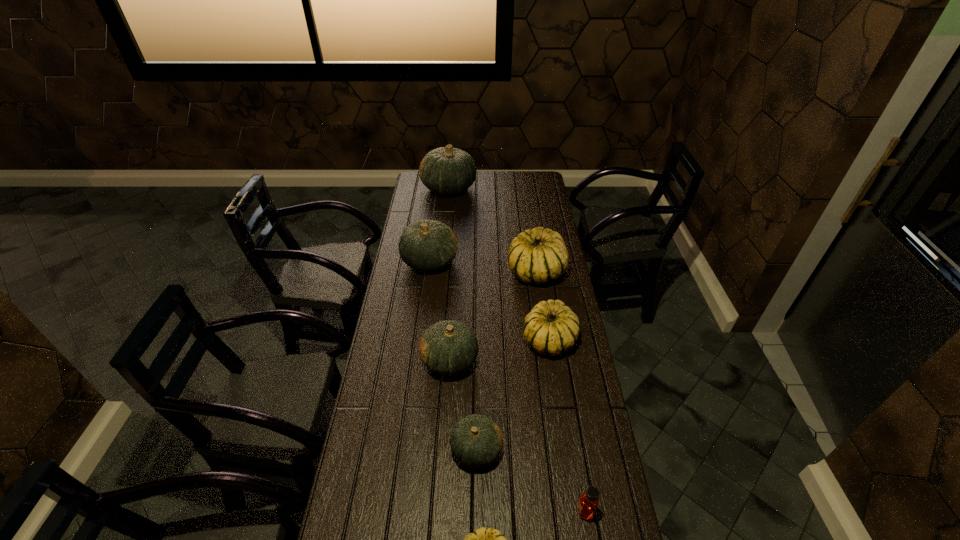
This screenshot has width=960, height=540. I want to click on the sixth closest object to the seventh farthest object, so click(426, 245).

Locate which object is the closest to the leftmost white gourd. Please provide its 2D coordinates. Your answer should be formatted as a tuple, i.e. [(x, y)], where the tuple contains the x and y coordinates of a point satisfying the conditions above.

[(476, 441)]

Identify the location of gourd that stands as the sixth closest to the farthest gourd. (482, 539).

Image resolution: width=960 pixels, height=540 pixels. I want to click on the third closest gourd to the seventh farthest object, so click(449, 347).

Locate an element on the screen. orange gourd that is the third closest to the nearest white gourd is located at coordinates pyautogui.click(x=426, y=245).

In order to click on the third closest orange gourd relative to the second smallest orange gourd in this screenshot , I will do `click(446, 170)`.

Identify the location of the third closest white gourd to the third biggest orange gourd. (482, 539).

This screenshot has width=960, height=540. I want to click on white gourd identified as the second closest to the third smallest orange gourd, so click(551, 328).

I want to click on vacant space that satisfies the following two spatial constraints: 1. on the back side of the second biggest white gourd; 2. on the right side of the sixth farthest object, so click(x=477, y=340).